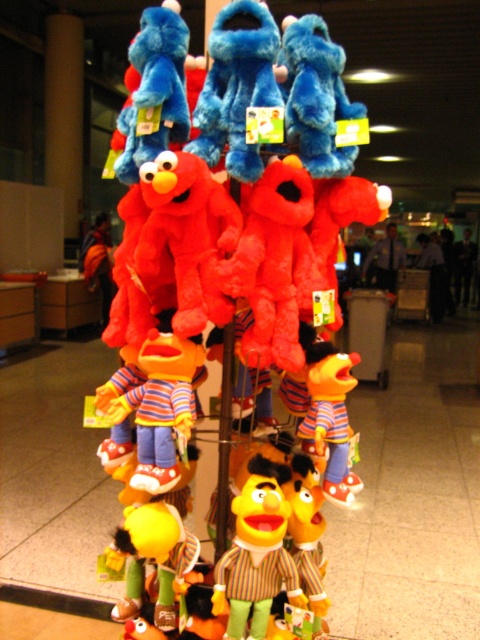
Does matte plush bert at center appear on the right side of striped fabric bert at center?

In fact, matte plush bert at center is to the left of striped fabric bert at center.

Between matte plush bert at center and striped fabric bert at center, which one has less height?

Standing shorter between the two is striped fabric bert at center.

Does point (151, 400) lie in front of point (321, 385)?

That is True.

Identify the location of matte plush bert at center. The height and width of the screenshot is (640, 480). (157, 406).

Is fluffy plush at center bigger than matte plush bert at center?

Yes, fluffy plush at center is bigger than matte plush bert at center.

Which is below, fluffy plush at center or matte plush bert at center?

Positioned lower is matte plush bert at center.

Find the location of a particular element. This screenshot has height=640, width=480. fluffy plush at center is located at coordinates (272, 209).

Locate an element on the screen. This screenshot has width=480, height=640. fluffy plush at center is located at coordinates (272, 209).

Can you confirm if fluffy plush at center is positioned above yellow plush bert at center?

Yes, fluffy plush at center is above yellow plush bert at center.

Can you confirm if fluffy plush at center is wider than yellow plush bert at center?

Correct, the width of fluffy plush at center exceeds that of yellow plush bert at center.

The height and width of the screenshot is (640, 480). In order to click on fluffy plush at center in this screenshot , I will do `click(272, 209)`.